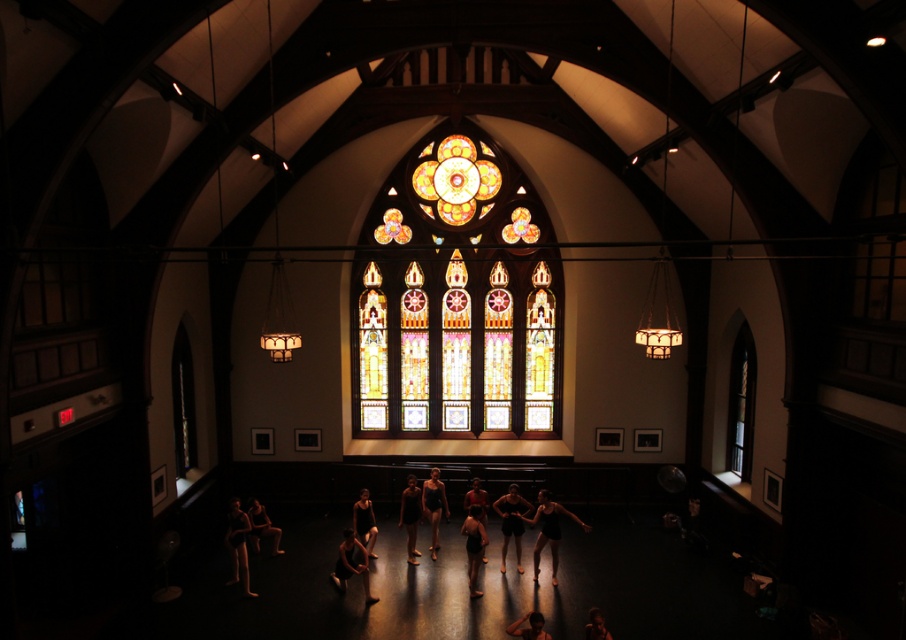
Is stained glass at center positioned behind black matte leotard at center?

No.

From the picture: Is stained glass at center positioned in front of black matte leotard at center?

Yes, stained glass at center is closer to the viewer.

Is point (458, 362) behind point (538, 540)?

Yes, it is.

At what (x,y) coordinates should I click in order to perform the action: click on stained glass at center. Please return your answer as a coordinate pair (x, y). This screenshot has width=906, height=640. Looking at the image, I should click on (456, 298).